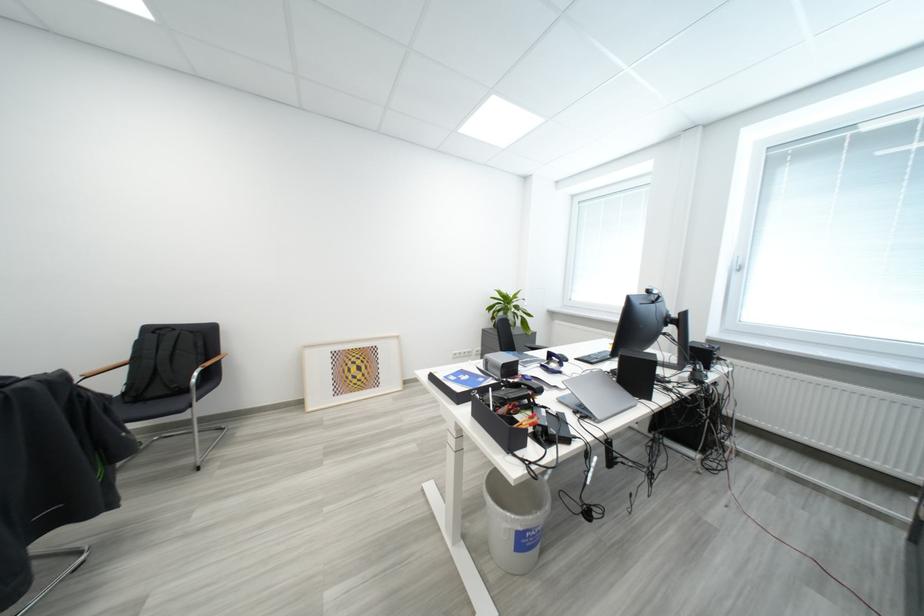
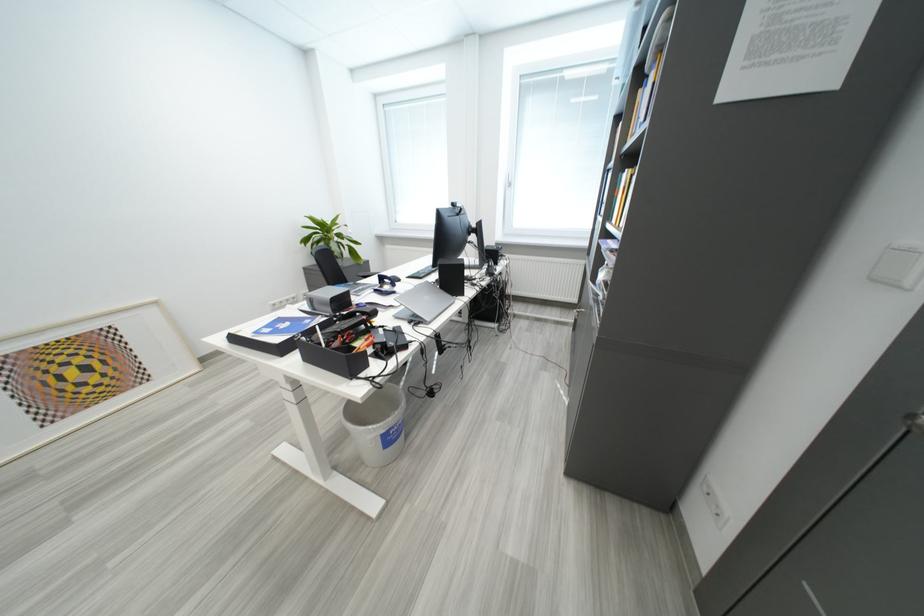
Locate, in the second image, the point that corresponds to point 483,418 in the first image.

(315, 362)